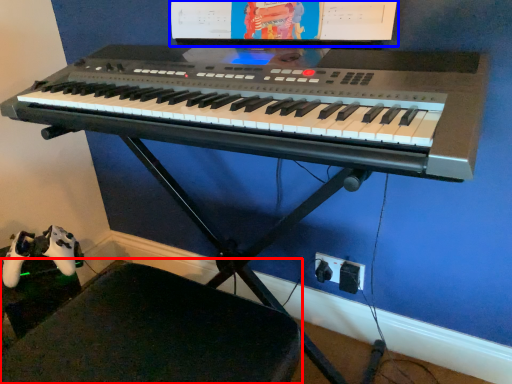
Question: Which object appears closest to the camera in this image, swivel chair (highlighted by a red box) or computer monitor (highlighted by a blue box)?

Choices:
 (A) swivel chair
 (B) computer monitor

Answer: (A)